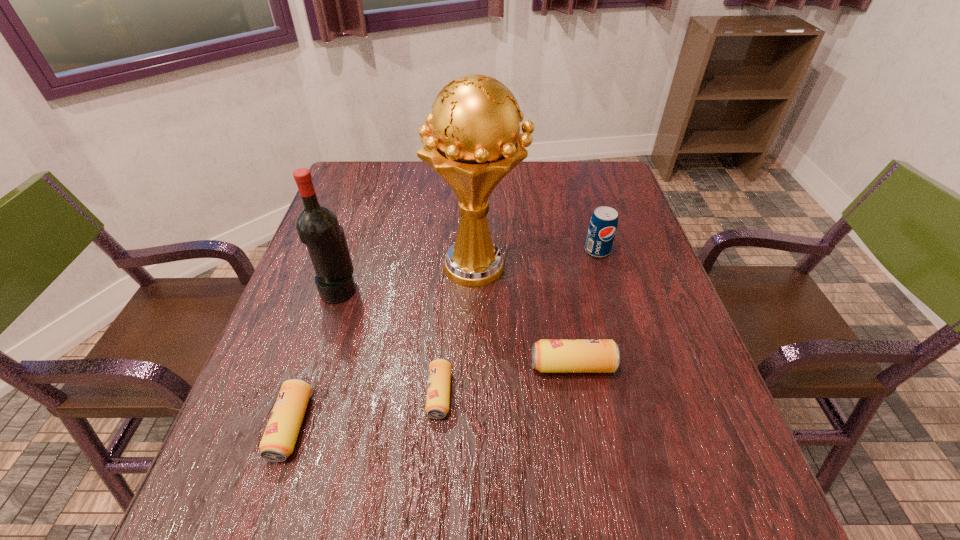
The height and width of the screenshot is (540, 960). In order to click on free space located 0.110m on the back of the fifth tallest object in this screenshot , I will do `click(317, 347)`.

You are a GUI agent. You are given a task and a screenshot of the screen. Output one action in this format:
    pyautogui.click(x=<x>, y=<y>)
    Task: Click on the free space located 0.190m on the right of the second beer can from left to right
    
    Given the screenshot: What is the action you would take?
    pyautogui.click(x=549, y=394)

Where is `vacant space located on the left of the third shortest object`? The width and height of the screenshot is (960, 540). vacant space located on the left of the third shortest object is located at coordinates (360, 366).

This screenshot has width=960, height=540. In order to click on vacant space situated on the back of the third tallest object in this screenshot , I will do `click(591, 228)`.

Where is `vacant space situated at the front of the trophy_cup where the globe is prominent`? This screenshot has height=540, width=960. vacant space situated at the front of the trophy_cup where the globe is prominent is located at coordinates (630, 265).

The image size is (960, 540). Find the location of `free location located 0.340m on the front of the wine bottle`. free location located 0.340m on the front of the wine bottle is located at coordinates (288, 447).

Locate an element on the screen. This screenshot has width=960, height=540. beer can at the left edge is located at coordinates (278, 441).

Find the location of a particular element. Image resolution: width=960 pixels, height=540 pixels. wine bottle at the left edge is located at coordinates (317, 226).

Identify the location of object located in the right edge section of the desktop. The height and width of the screenshot is (540, 960). (603, 224).

Where is `object located at the near left corner`? object located at the near left corner is located at coordinates (x=278, y=441).